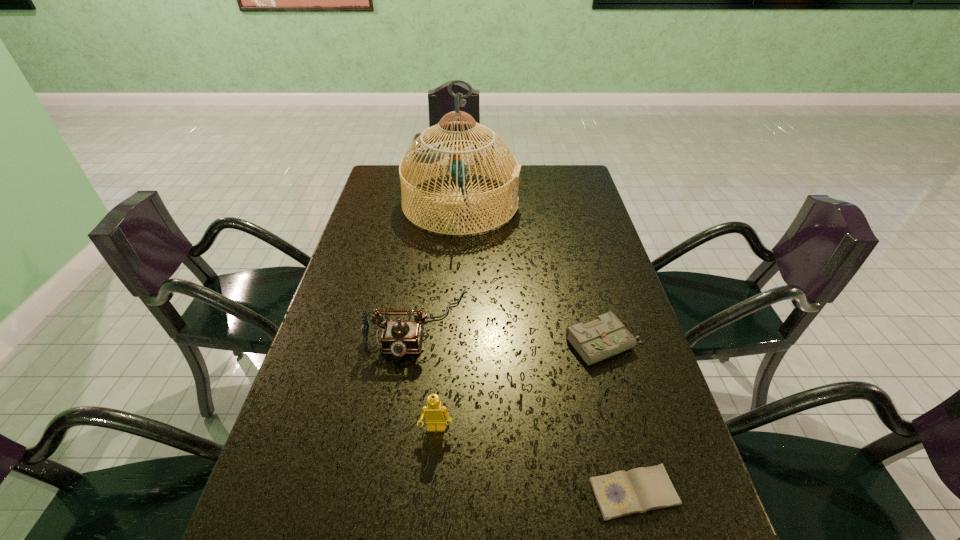
The image size is (960, 540). I want to click on the farthest object, so click(x=434, y=152).

Identify the location of the tallest object. This screenshot has height=540, width=960. (434, 152).

At what (x,y) coordinates should I click in order to perform the action: click on telephone. Please return your answer as a coordinate pair (x, y). The image size is (960, 540). Looking at the image, I should click on (399, 337).

The image size is (960, 540). What are the coordinates of `Lego` in the screenshot? It's located at (434, 413).

Locate an element on the screen. The width and height of the screenshot is (960, 540). the farther diary is located at coordinates (606, 336).

The height and width of the screenshot is (540, 960). Find the location of `the fourth tallest object`. the fourth tallest object is located at coordinates (606, 336).

I want to click on the shorter diary, so click(621, 493).

Find the location of `the nearer diary`. the nearer diary is located at coordinates (621, 493).

At what (x,y) coordinates should I click in order to perform the action: click on vacant area located 0.390m on the front of the tallest object. Please return your answer as a coordinate pair (x, y). Looking at the image, I should click on click(453, 329).

Locate an element on the screen. vacant region located 0.260m on the dial of the telephone is located at coordinates (395, 470).